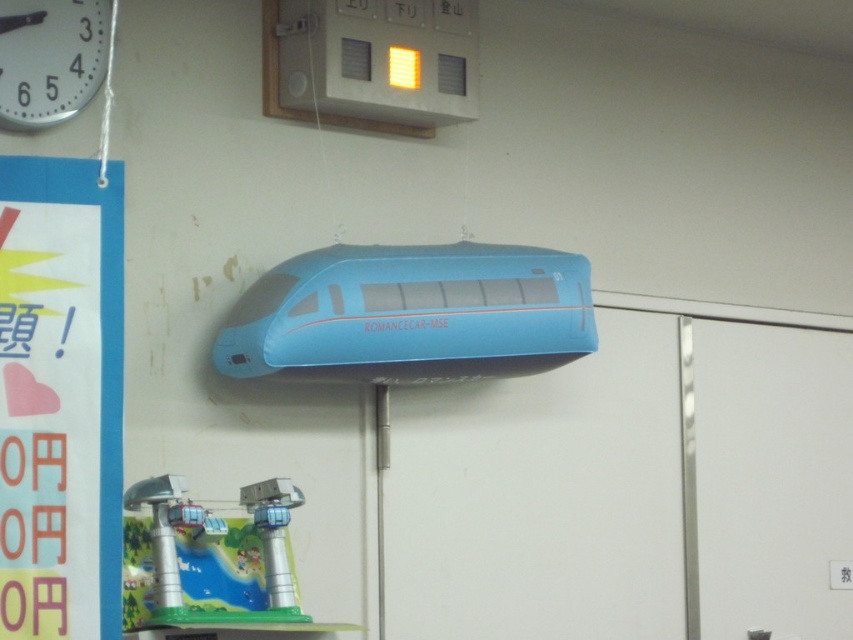
Question: Does blue cardboard sign at left appear on the right side of metallic clock at upper left?

Choices:
 (A) yes
 (B) no

Answer: (A)

Question: Which of the following is the farthest from the observer?

Choices:
 (A) (109, 4)
 (B) (15, 337)
 (C) (505, 252)

Answer: (C)

Question: Can you confirm if blue cardboard sign at left is wider than metallic clock at upper left?

Choices:
 (A) no
 (B) yes

Answer: (A)

Question: Estimate the real-world distances between objects in this image. Which object is farther from the metallic clock at upper left?

Choices:
 (A) blue matte train at center
 (B) blue cardboard sign at left

Answer: (A)

Question: Does blue matte train at center have a larger size compared to metallic clock at upper left?

Choices:
 (A) yes
 (B) no

Answer: (A)

Question: Based on their relative distances, which object is nearer to the metallic clock at upper left?

Choices:
 (A) blue cardboard sign at left
 (B) blue matte train at center

Answer: (A)